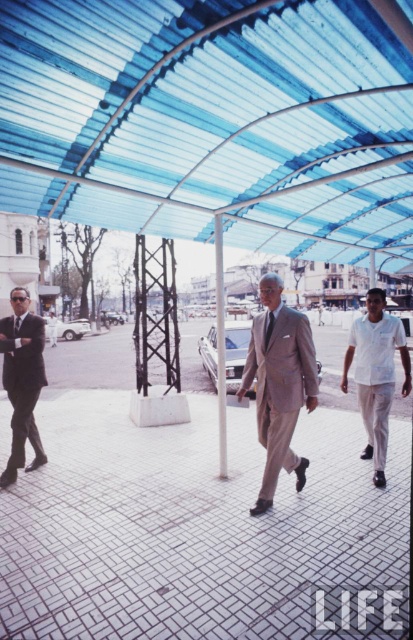
Question: Observing the image, what is the correct spatial positioning of transparent plastic canopy at center in reference to light gray suit at center?

Choices:
 (A) left
 (B) right

Answer: (B)

Question: Among these objects, which one is nearest to the camera?

Choices:
 (A) matte black suit at left
 (B) transparent plastic canopy at center

Answer: (B)

Question: Is white tile pavement at center closer to the viewer compared to light gray suit at center?

Choices:
 (A) no
 (B) yes

Answer: (B)

Question: Which of these objects is positioned closest to the white smooth shirt at right?

Choices:
 (A) white tile pavement at center
 (B) matte black suit at left

Answer: (A)

Question: Which point is closer to the camera?

Choices:
 (A) transparent plastic canopy at center
 (B) white smooth shirt at right

Answer: (A)

Question: Does transparent plastic canopy at center appear over light gray suit at center?

Choices:
 (A) no
 (B) yes

Answer: (B)